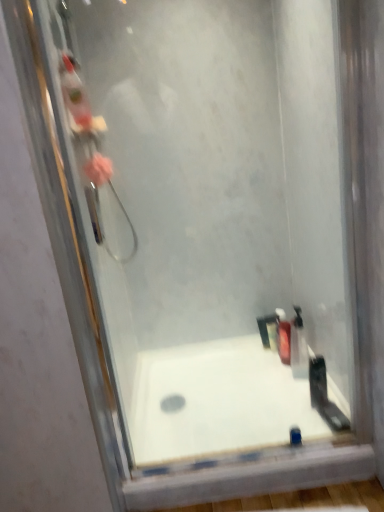
Question: Is black plastic razor at right, the third toiletry when ordered from back to front, shorter than translucent plastic bottle at lower right, which is the second toiletry from front to back?

Choices:
 (A) yes
 (B) no

Answer: (A)

Question: Is translucent plastic bottle at lower right, which appears as the second toiletry when viewed from the back, at the back of black plastic razor at right, which is the first toiletry in front-to-back order?

Choices:
 (A) yes
 (B) no

Answer: (A)

Question: Does black plastic razor at right, which is the first toiletry in front-to-back order, appear on the left side of translucent plastic bottle at lower right, which appears as the second toiletry when viewed from the back?

Choices:
 (A) yes
 (B) no

Answer: (A)

Question: From a real-world perspective, is black plastic razor at right, which is the first toiletry in front-to-back order, physically above translucent plastic bottle at lower right, which appears as the second toiletry when viewed from the back?

Choices:
 (A) yes
 (B) no

Answer: (A)

Question: Does black plastic razor at right, which is the first toiletry in front-to-back order, come in front of translucent plastic bottle at lower right, which appears as the second toiletry when viewed from the back?

Choices:
 (A) yes
 (B) no

Answer: (A)

Question: Is point (299, 337) closer or farther from the camera than point (86, 176)?

Choices:
 (A) closer
 (B) farther

Answer: (B)

Question: From the image's perspective, is translucent plastic bottle at lower right, which appears as the second toiletry when viewed from the back, above or below pink fluffy sponge at left?

Choices:
 (A) above
 (B) below

Answer: (B)

Question: From their relative heights in the image, would you say translucent plastic bottle at lower right, which is the second toiletry from front to back, is taller or shorter than pink fluffy sponge at left?

Choices:
 (A) short
 (B) tall

Answer: (B)

Question: Considering their positions, is translucent plastic bottle at lower right, which appears as the second toiletry when viewed from the back, located in front of or behind pink fluffy sponge at left?

Choices:
 (A) front
 (B) behind

Answer: (B)

Question: From a real-world perspective, is black plastic razor at right, the third toiletry when ordered from back to front, positioned above or below pink fluffy sponge at left?

Choices:
 (A) below
 (B) above

Answer: (A)

Question: Is black plastic razor at right, the third toiletry when ordered from back to front, inside the boundaries of pink fluffy sponge at left, or outside?

Choices:
 (A) outside
 (B) inside

Answer: (A)

Question: Based on their sizes in the image, would you say black plastic razor at right, which is the first toiletry in front-to-back order, is bigger or smaller than pink fluffy sponge at left?

Choices:
 (A) small
 (B) big

Answer: (A)

Question: Considering their positions, is black plastic razor at right, the third toiletry when ordered from back to front, located in front of or behind pink fluffy sponge at left?

Choices:
 (A) behind
 (B) front

Answer: (A)

Question: From the image's perspective, is translucent plastic bottle at lower right, which appears as the second toiletry when viewed from the back, located above or below white glossy bathtub at center?

Choices:
 (A) below
 (B) above

Answer: (B)

Question: From a real-world perspective, is translucent plastic bottle at lower right, which appears as the second toiletry when viewed from the back, physically located above or below white glossy bathtub at center?

Choices:
 (A) below
 (B) above

Answer: (B)